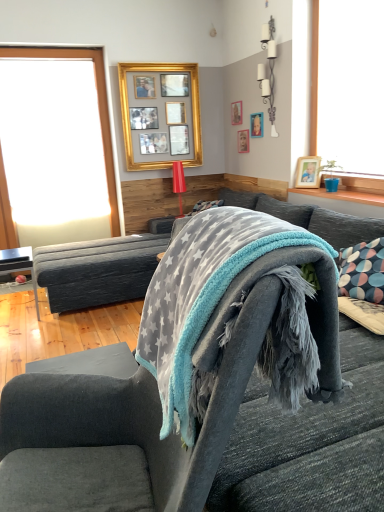
Question: Is wooden picture frame at upper center, acting as the second picture frame starting from the left, facing away from gold metallic picture frame at upper center, the fifth picture frame positioned from the right?

Choices:
 (A) no
 (B) yes

Answer: (A)

Question: From a real-world perspective, is wooden picture frame at upper center, the 4th picture frame viewed from the right, positioned over gold metallic picture frame at upper center, which is the first picture frame from left to right, based on gravity?

Choices:
 (A) no
 (B) yes

Answer: (B)

Question: From the image's perspective, is wooden picture frame at upper center, the 4th picture frame viewed from the right, on gold metallic picture frame at upper center, which is the first picture frame from left to right?

Choices:
 (A) yes
 (B) no

Answer: (A)

Question: Is there a large distance between wooden picture frame at upper center, acting as the second picture frame starting from the left, and gold metallic picture frame at upper center, which is the first picture frame from left to right?

Choices:
 (A) no
 (B) yes

Answer: (A)

Question: Is gold metallic picture frame at upper center, the fifth picture frame positioned from the right, completely or partially inside wooden picture frame at upper center, the 4th picture frame viewed from the right?

Choices:
 (A) yes
 (B) no

Answer: (B)

Question: From a real-world perspective, relative to wooden picture frame at upper center, which is the 2th picture frame in right-to-left order, is wooden picture frame at upper center, acting as the second picture frame starting from the left, vertically above or below?

Choices:
 (A) below
 (B) above

Answer: (B)

Question: Would you say wooden picture frame at upper center, acting as the second picture frame starting from the left, is inside or outside wooden picture frame at upper center, the fourth picture frame when ordered from left to right?

Choices:
 (A) inside
 (B) outside

Answer: (B)

Question: In terms of width, does wooden picture frame at upper center, acting as the second picture frame starting from the left, look wider or thinner when compared to wooden picture frame at upper center, which is the 2th picture frame in right-to-left order?

Choices:
 (A) thin
 (B) wide

Answer: (B)

Question: Considering the positions of wooden picture frame at upper center, acting as the second picture frame starting from the left, and wooden picture frame at upper center, which is the 2th picture frame in right-to-left order, in the image, is wooden picture frame at upper center, acting as the second picture frame starting from the left, taller or shorter than wooden picture frame at upper center, which is the 2th picture frame in right-to-left order,?

Choices:
 (A) short
 (B) tall

Answer: (B)

Question: Is velvet grey couch at center in front of or behind velvet grey armchair at center in the image?

Choices:
 (A) front
 (B) behind

Answer: (B)

Question: Considering the positions of point (x=96, y=263) and point (x=105, y=402), is point (x=96, y=263) closer or farther from the camera than point (x=105, y=402)?

Choices:
 (A) closer
 (B) farther

Answer: (B)

Question: Based on their sizes in the image, would you say velvet grey couch at center is bigger or smaller than velvet grey armchair at center?

Choices:
 (A) big
 (B) small

Answer: (A)

Question: From a real-world perspective, is velvet grey couch at center above or below velvet grey armchair at center?

Choices:
 (A) above
 (B) below

Answer: (B)

Question: In the image, is gray star-patterned towel at center on the left side or the right side of gold metallic picture frame at upper center, the fifth picture frame positioned from the right?

Choices:
 (A) left
 (B) right

Answer: (B)

Question: Considering the positions of gray star-patterned towel at center and gold metallic picture frame at upper center, the fifth picture frame positioned from the right, in the image, is gray star-patterned towel at center taller or shorter than gold metallic picture frame at upper center, the fifth picture frame positioned from the right,?

Choices:
 (A) short
 (B) tall

Answer: (A)